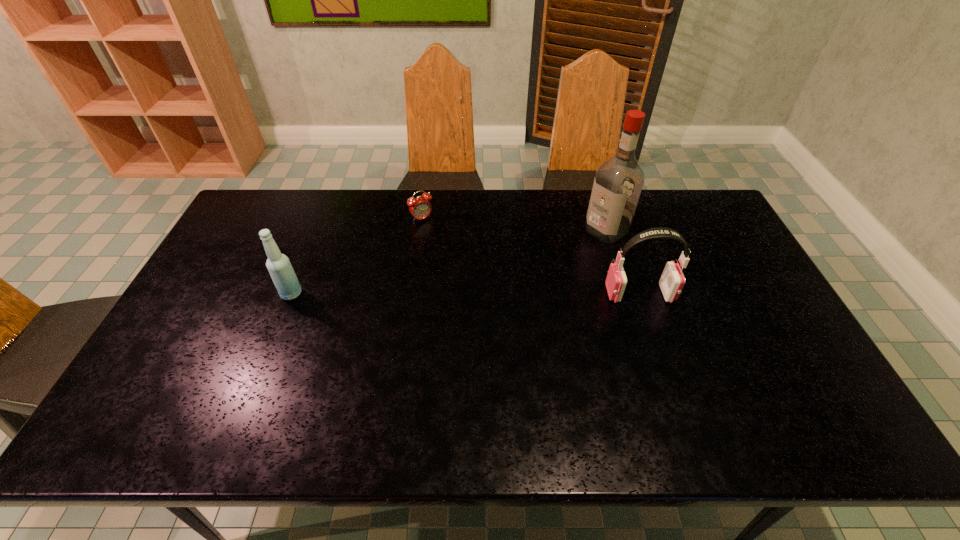
Find the location of `the leftmost object`. the leftmost object is located at coordinates (281, 271).

I want to click on earphone, so click(x=672, y=281).

At what (x,y) coordinates should I click in order to perform the action: click on liquor. Please return your answer as a coordinate pair (x, y). This screenshot has width=960, height=540. Looking at the image, I should click on (618, 182).

You are a GUI agent. You are given a task and a screenshot of the screen. Output one action in this format:
    pyautogui.click(x=<x>, y=<y>)
    Task: Click on the alarm clock
    The width and height of the screenshot is (960, 540).
    Given the screenshot: What is the action you would take?
    [x=420, y=208]

Where is `the third object from right to left`? This screenshot has width=960, height=540. the third object from right to left is located at coordinates (420, 208).

Identify the location of vacant region located 0.290m on the back of the bottle. (320, 224).

Image resolution: width=960 pixels, height=540 pixels. In order to click on free region located 0.210m on the outer surface of the earphone in this screenshot , I will do `click(535, 294)`.

What are the coordinates of `blank space located on the outer surface of the earphone` in the screenshot? It's located at pyautogui.click(x=508, y=294).

Identify the location of free space located 0.260m on the outer surface of the earphone. (517, 294).

Where is `vacant space located 0.210m on the front-facing side of the tallest object`? vacant space located 0.210m on the front-facing side of the tallest object is located at coordinates (547, 268).